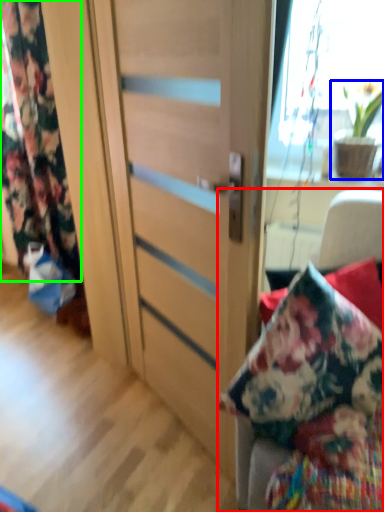
Question: Which is nearer to the furniture (highlighted by a red box)? houseplant (highlighted by a blue box) or curtain (highlighted by a green box).

Choices:
 (A) houseplant
 (B) curtain

Answer: (A)